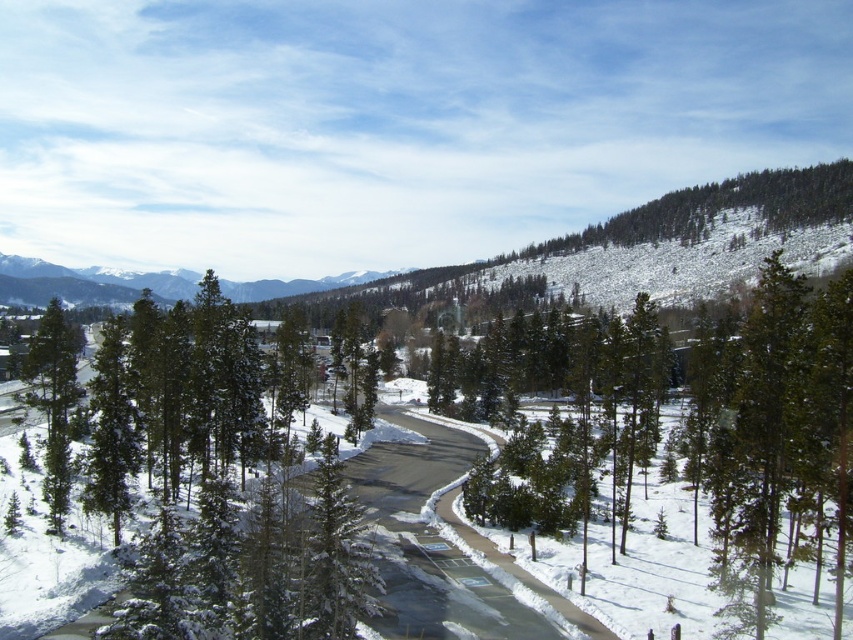
You are standing at the starting point of the road in the winter landscape. You want to walk straight ahead along the road. Will you pass by the green textured pine at center?

Yes, the green textured pine at center is located at point (x=770, y=429) which is along the road path, so you will pass by it while walking straight ahead along the road.

You are a hiker planning to walk along the winding road in the winter landscape. You notice two trees near the path, the green textured pine at center and the green matte tree at left. Which tree has a larger width?

The green textured pine at center might be wider than green matte tree at left.